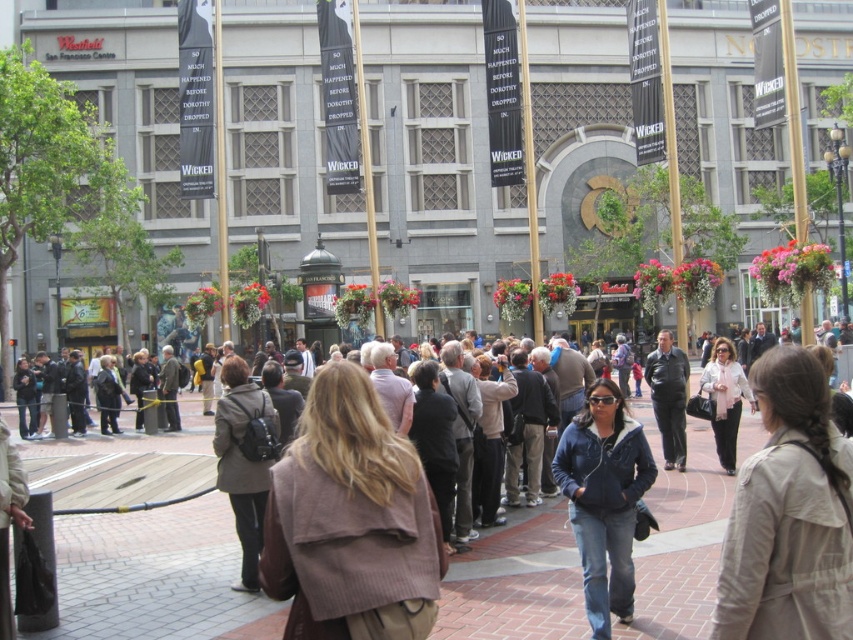
You are a photographer trying to capture a candid shot of the crowd in front of the theater. You notice the light beige coat at center and the denim jacket at center. Which one is positioned higher in the image?

The light beige coat at center is located above the denim jacket at center, so it is positioned higher in the image.